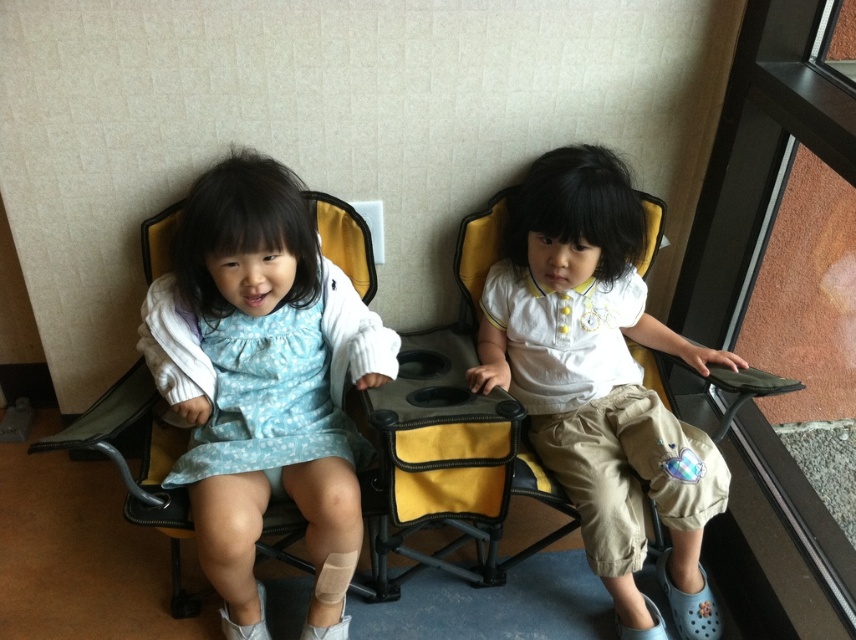
Question: Does matte blue dress at center appear on the left side of white cotton shirt at center?

Choices:
 (A) no
 (B) yes

Answer: (B)

Question: Which point is farther from the camera taking this photo?

Choices:
 (A) (201, 250)
 (B) (551, 205)

Answer: (B)

Question: Observing the image, what is the correct spatial positioning of matte blue dress at center in reference to white cotton shirt at center?

Choices:
 (A) left
 (B) right

Answer: (A)

Question: Can you confirm if matte blue dress at center is smaller than white cotton shirt at center?

Choices:
 (A) yes
 (B) no

Answer: (A)

Question: Which of the following is the closest to the observer?

Choices:
 (A) white cotton shirt at center
 (B) matte blue dress at center

Answer: (B)

Question: Among these objects, which one is farthest from the camera?

Choices:
 (A) white cotton shirt at center
 (B) matte blue dress at center

Answer: (A)